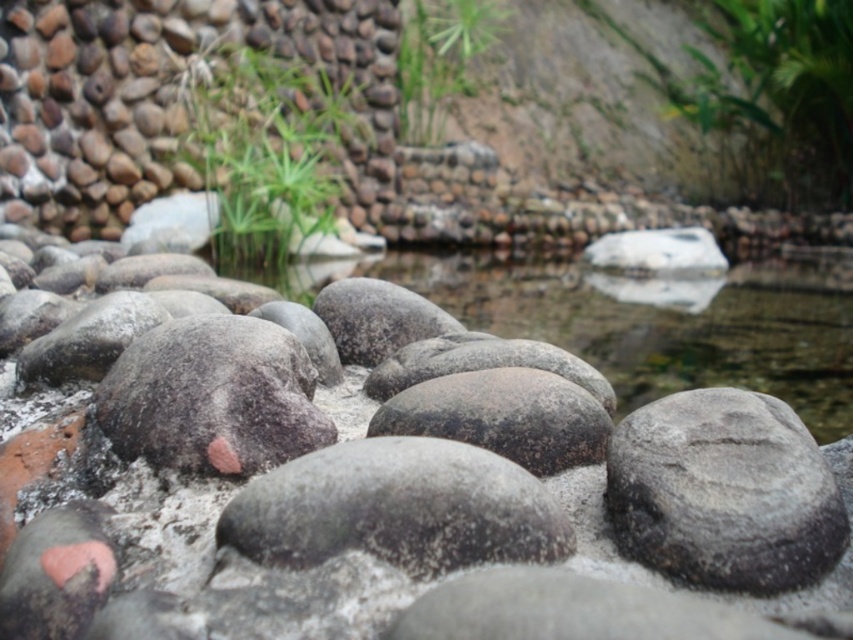
Is green leafy plant at center above green grass at upper center?

Actually, green leafy plant at center is below green grass at upper center.

Who is more forward, (247, 112) or (438, 100)?

Positioned in front is point (247, 112).

At what (x,y) coordinates should I click in order to perform the action: click on green leafy plant at center. Please return your answer as a coordinate pair (x, y). Image resolution: width=853 pixels, height=640 pixels. Looking at the image, I should click on (270, 150).

How distant is green leafy plant at upper right from green grass at upper center?

green leafy plant at upper right is 11.63 feet away from green grass at upper center.

Between green leafy plant at upper right and green grass at upper center, which one appears on the left side from the viewer's perspective?

green grass at upper center

Measure the distance between green leafy plant at upper right and camera.

A distance of 9.43 meters exists between green leafy plant at upper right and camera.

At what (x,y) coordinates should I click in order to perform the action: click on green leafy plant at upper right. Please return your answer as a coordinate pair (x, y). The image size is (853, 640). Looking at the image, I should click on (773, 104).

Is gray matte rock at center positioned in front of green leafy plant at upper right?

Yes.

In the scene shown: Between gray matte rock at center and green leafy plant at upper right, which one is positioned higher?

green leafy plant at upper right is above.

Measure the distance between gray matte rock at center and camera.

A distance of 14.66 inches exists between gray matte rock at center and camera.

In order to click on gray matte rock at center in this screenshot , I will do `click(384, 540)`.